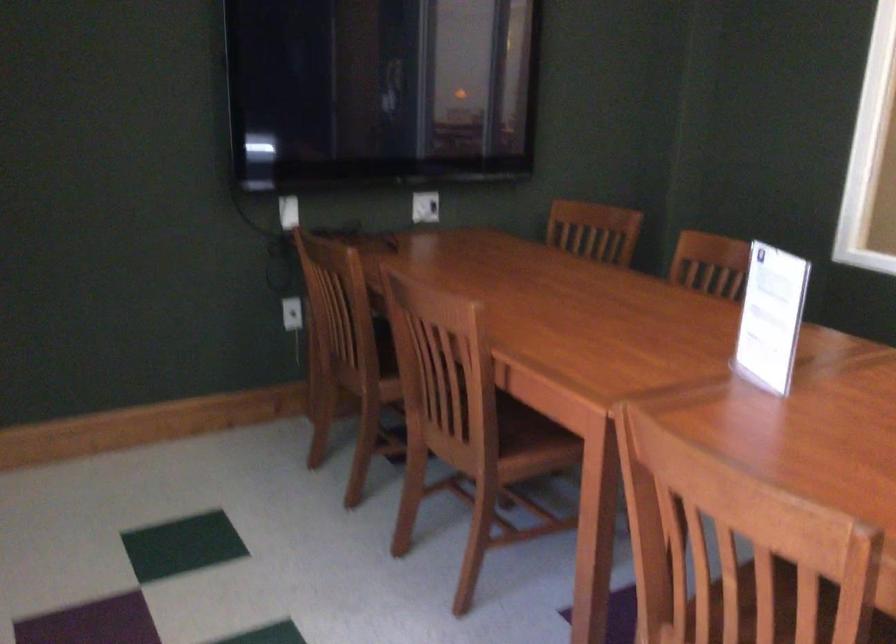
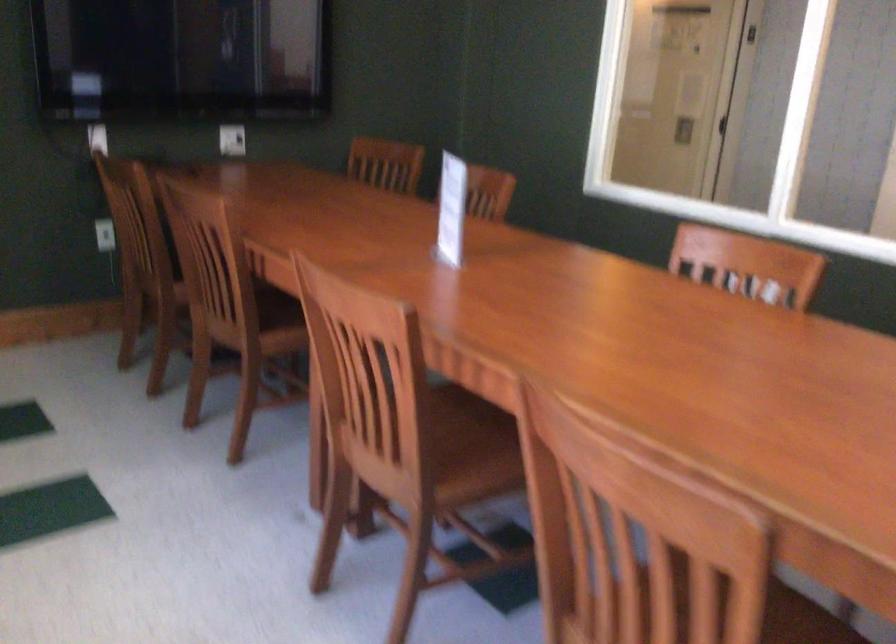
In the second image, find the point that corresponds to [477,419] in the first image.

(239, 303)